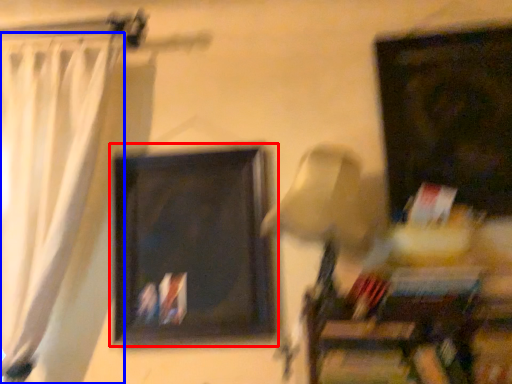
Question: Which object appears closest to the camera in this image, picture frame (highlighted by a red box) or curtain (highlighted by a blue box)?

Choices:
 (A) picture frame
 (B) curtain

Answer: (B)